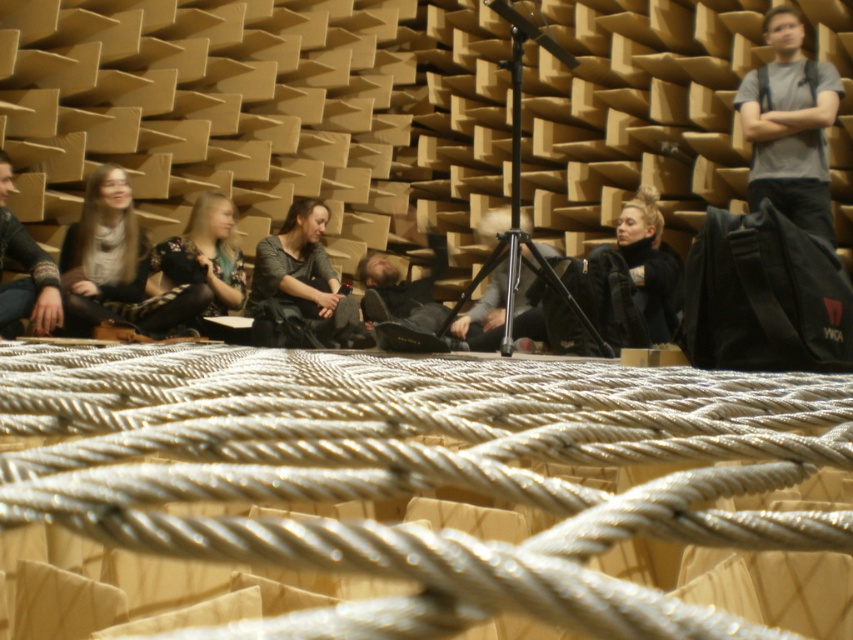
Question: Does gray cotton t-shirt at upper right have a greater width compared to matte black jacket at center?

Choices:
 (A) no
 (B) yes

Answer: (B)

Question: Is silver metallic rope at center closer to camera compared to matte black jacket at center?

Choices:
 (A) no
 (B) yes

Answer: (B)

Question: Does silver metallic rope at center lie behind matte black sweater at left?

Choices:
 (A) no
 (B) yes

Answer: (A)

Question: Which point is farther to the camera?

Choices:
 (A) (776, 180)
 (B) (650, 308)
 (C) (90, 234)
 (D) (41, 260)

Answer: (B)

Question: Which point is farther to the camera?

Choices:
 (A) (33, 262)
 (B) (518, 448)
 (C) (119, 289)
 (D) (791, 218)

Answer: (C)

Question: Which point appears farthest from the camera in this image?

Choices:
 (A) (647, 237)
 (B) (99, 301)
 (C) (822, 384)
 (D) (283, 282)

Answer: (D)